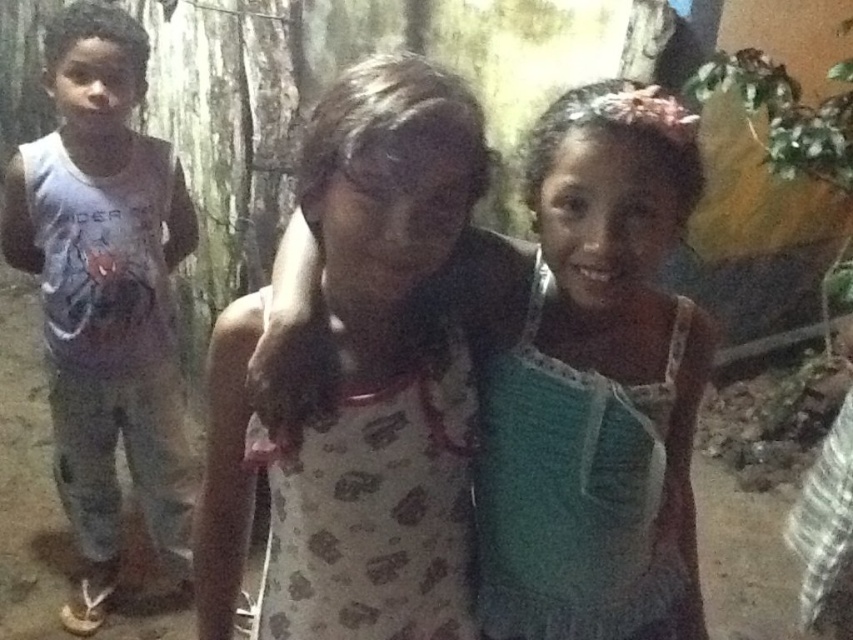
Question: Considering the relative positions of brown printed dress at center and matte gray tank top at left in the image provided, where is brown printed dress at center located with respect to matte gray tank top at left?

Choices:
 (A) below
 (B) above

Answer: (A)

Question: Based on their relative distances, which object is farther from the brown printed dress at center?

Choices:
 (A) printed fabric dress at center
 (B) matte gray tank top at left

Answer: (B)

Question: Does printed fabric dress at center have a lesser width compared to matte gray tank top at left?

Choices:
 (A) yes
 (B) no

Answer: (A)

Question: Does brown printed dress at center have a greater width compared to matte gray tank top at left?

Choices:
 (A) yes
 (B) no

Answer: (B)

Question: Which of these objects is positioned farthest from the brown printed dress at center?

Choices:
 (A) matte gray tank top at left
 (B) printed fabric dress at center

Answer: (A)

Question: Based on their relative distances, which object is nearer to the printed fabric dress at center?

Choices:
 (A) matte gray tank top at left
 (B) brown printed dress at center

Answer: (B)